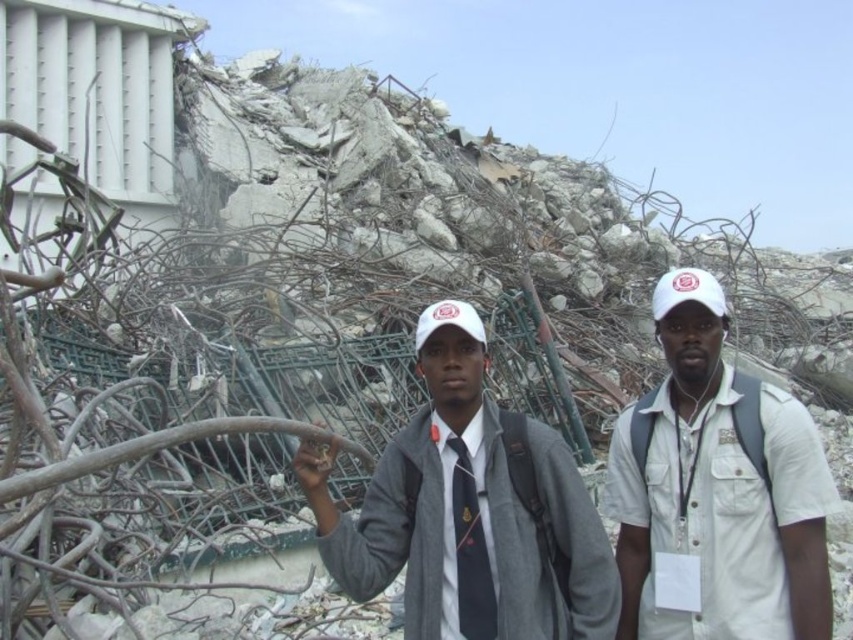
From the picture: You are a member of the rescue team looking for survivors in the rubble. You notice two items in the center of the scene. Which one is positioned to the right of the other? The items are the white cotton cap at center and the matte gray jacket at center.

The white cotton cap at center is to the right of the matte gray jacket at center.

In the scene shown: You are a rescue worker at the disaster site. You need to reach a specific point marked at coordinates point (660, 604). The debris field is unstable. Your team has a drone that can fly up to 100 feet. Can the drone reach the point from your current position?

The point (660, 604) is 115.18 feet away from the camera. Since the drone can only fly up to 100 feet, it cannot reach the point from your current position.